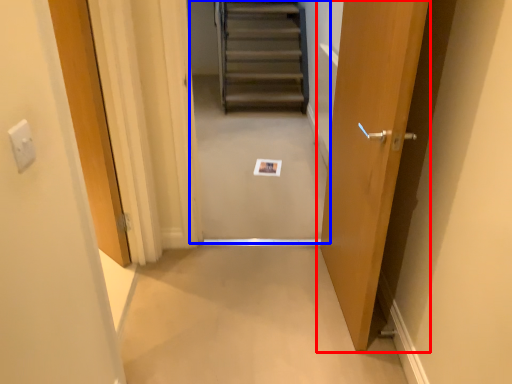
Question: Which point is closer to the camera, door (highlighted by a red box) or escalator (highlighted by a blue box)?

Choices:
 (A) door
 (B) escalator

Answer: (A)